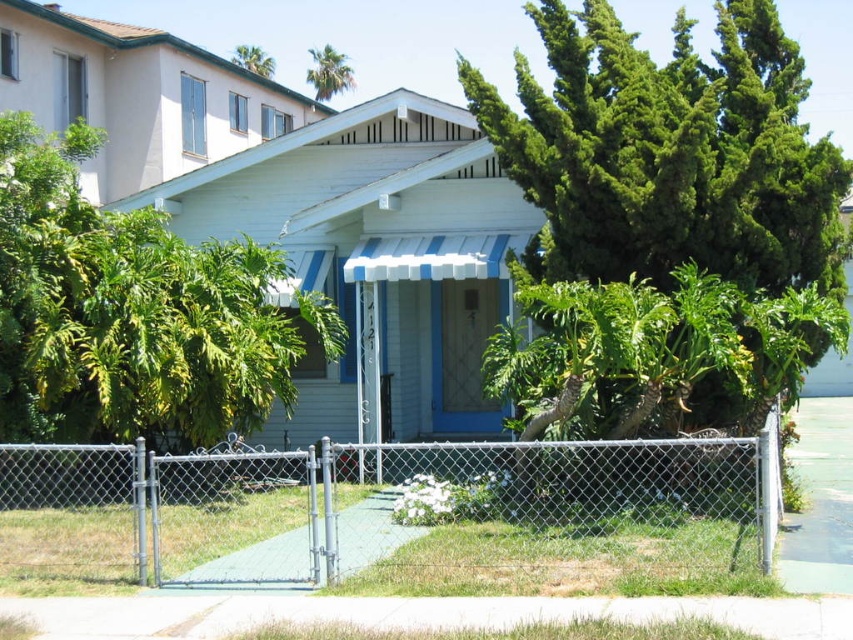
You are standing in front of the house and see a point at coordinates (372, 509). Based on the scene description, what object is located at that point?

The point at coordinates (372, 509) corresponds to the metallic silver fence at lower left.

You are a landscape architect designing a garden around the house. You need to place a new bench between the green leafy tree at left and the green leafy palm tree at upper center. Which tree should the bench be closer to if you want it to be closer to the taller tree?

The bench should be closer to the green leafy palm tree at upper center because it is taller than the green leafy tree at left.